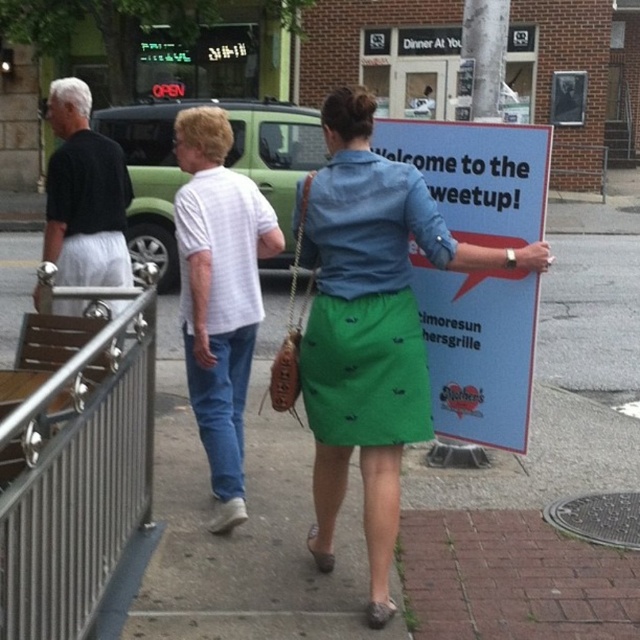
You are a photographer standing on the sidewalk. You want to take a photo of the green fabric skirt at center and the white woven shirt at center. The minimum distance required between the subjects for your camera to focus properly is 8 feet. Do you think you can capture both subjects in focus?

The distance between the green fabric skirt at center and the white woven shirt at center is 7.47 feet, which is less than the required 8 feet. Therefore, the camera may struggle to keep both subjects in focus.